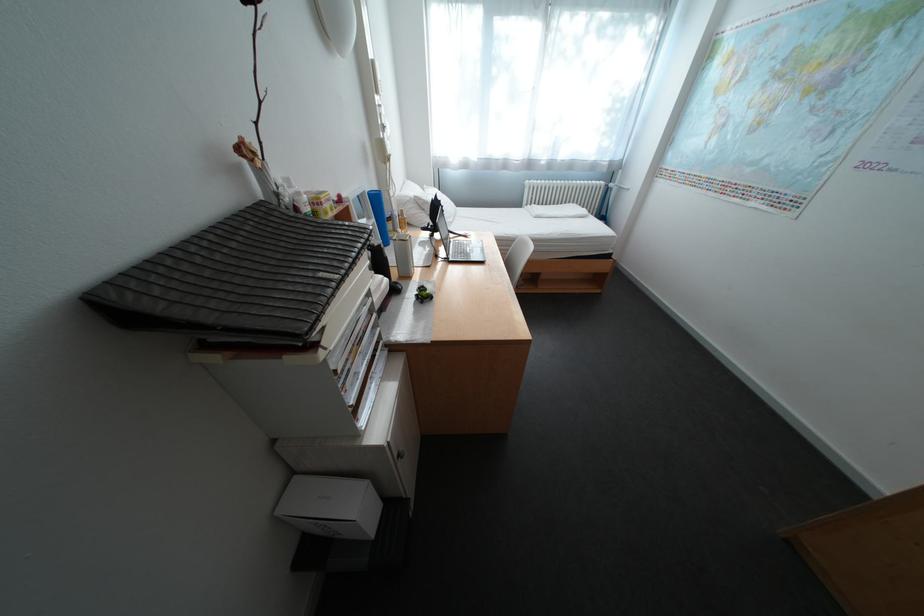
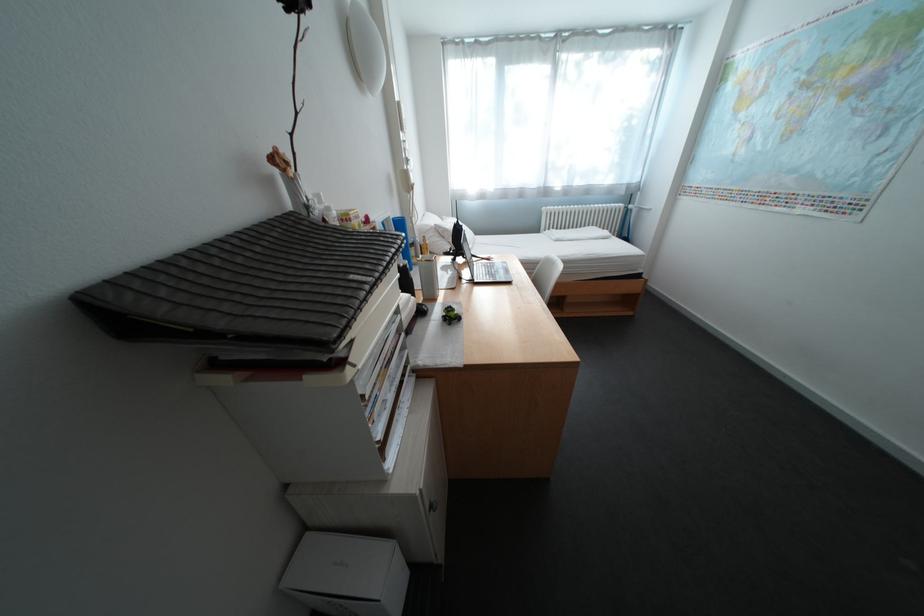
Question: The first image is from the beginning of the video and the second image is from the end. How did the camera likely rotate when shooting the video?

Choices:
 (A) Left
 (B) Right
 (C) Up
 (D) Down

Answer: (C)